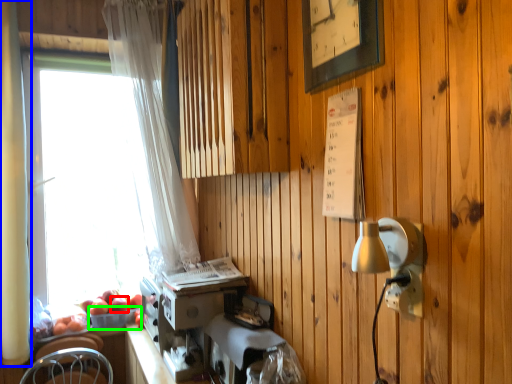
Question: Estimate the real-world distances between objects in this image. Which object is farther from apple (highlighted by a red box), curtain (highlighted by a blue box) or basket (highlighted by a green box)?

Choices:
 (A) curtain
 (B) basket

Answer: (A)